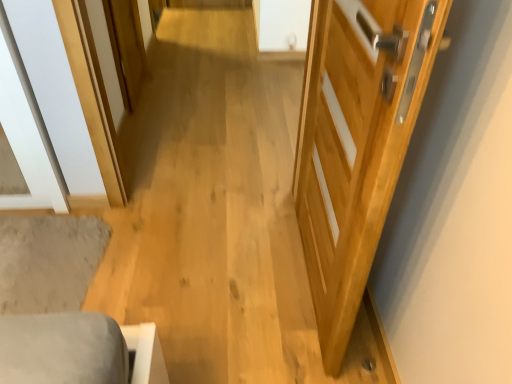
The width and height of the screenshot is (512, 384). I want to click on free spot to the left of natural wood door at right, so click(x=211, y=275).